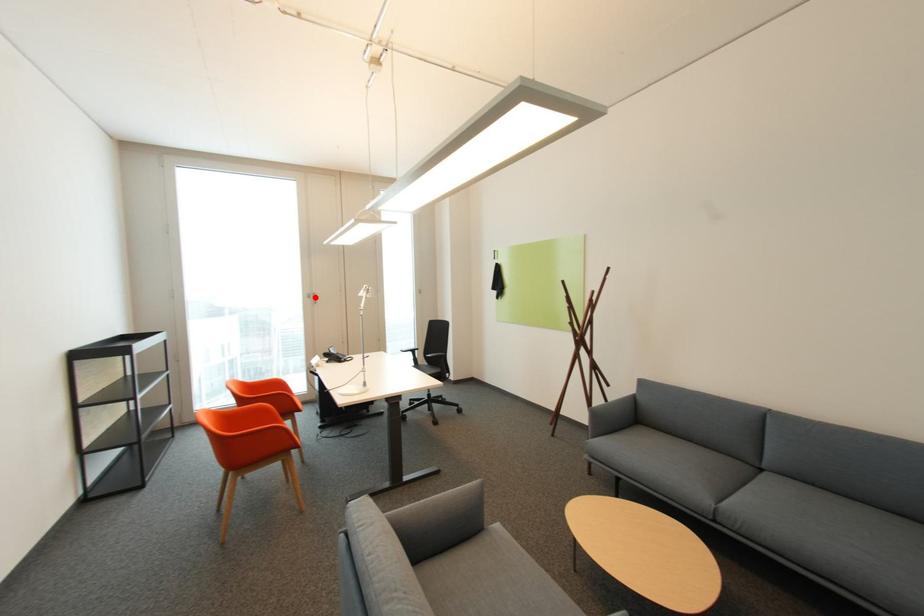
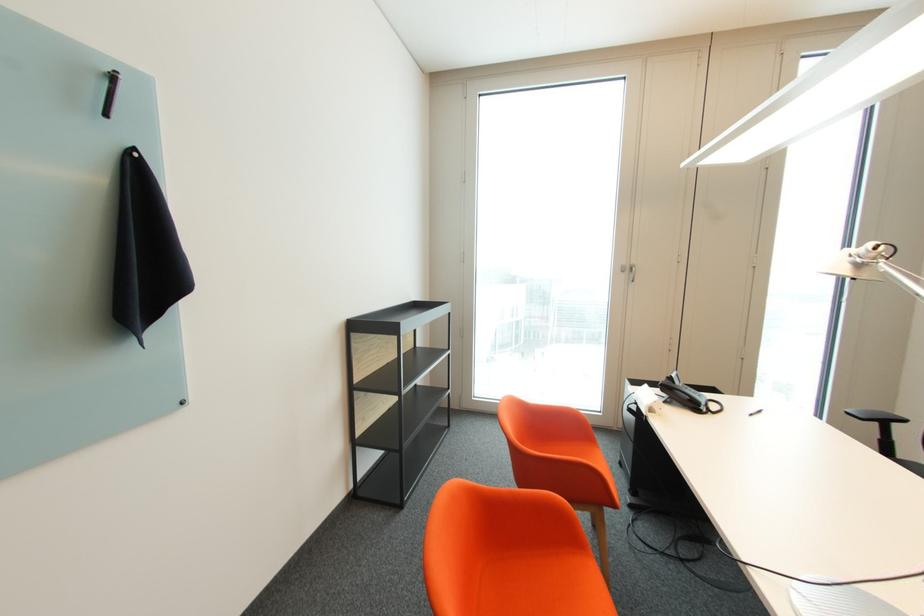
Find the pixel in the second image that matches the highlighted location in the first image.

(629, 272)